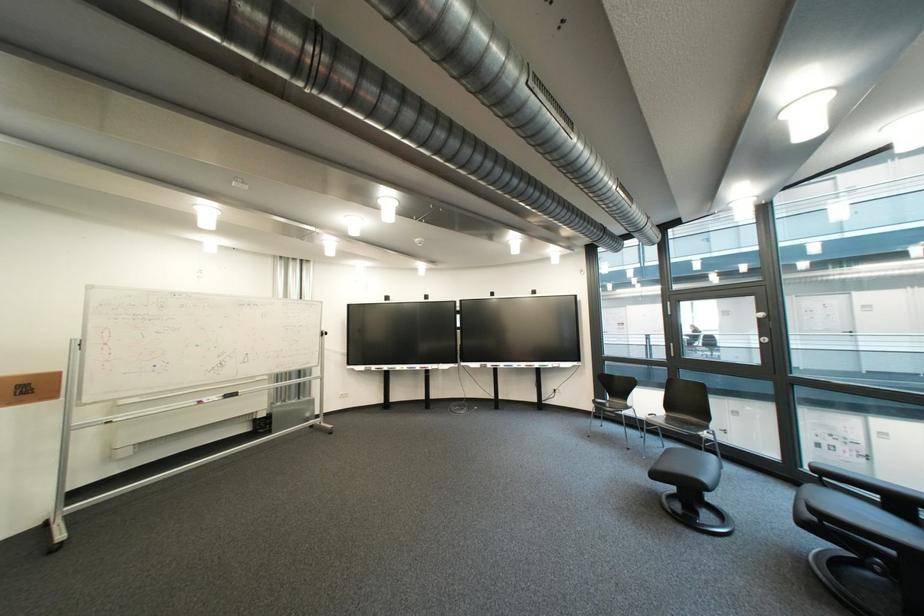
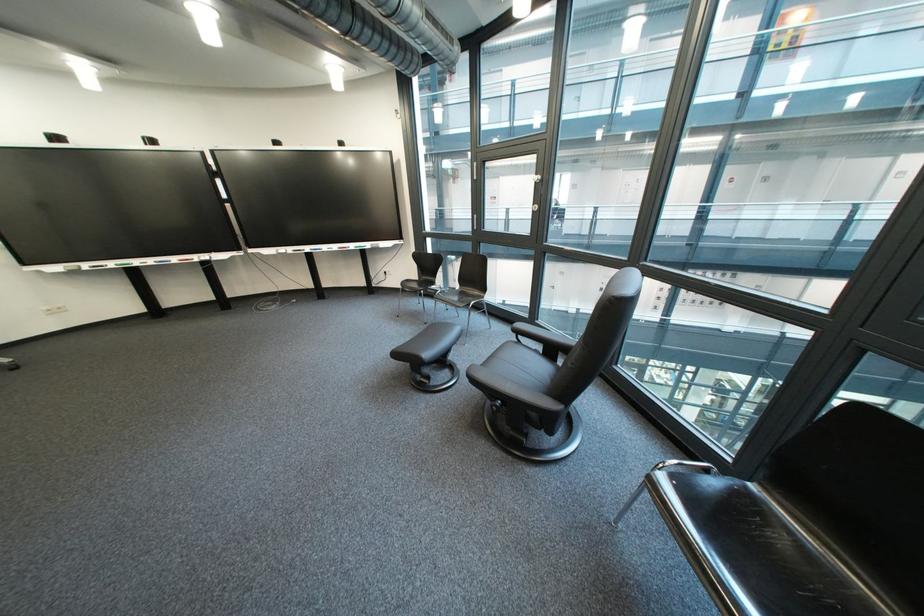
In the second image, find the point that corresponds to pixel 386 369 in the first image.

(100, 267)